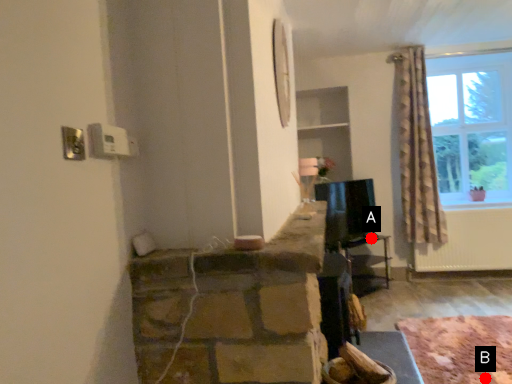
Question: Two points are circled on the image, labeled by A and B beside each circle. Which point is further to the camera?

Choices:
 (A) A is further
 (B) B is further

Answer: (A)